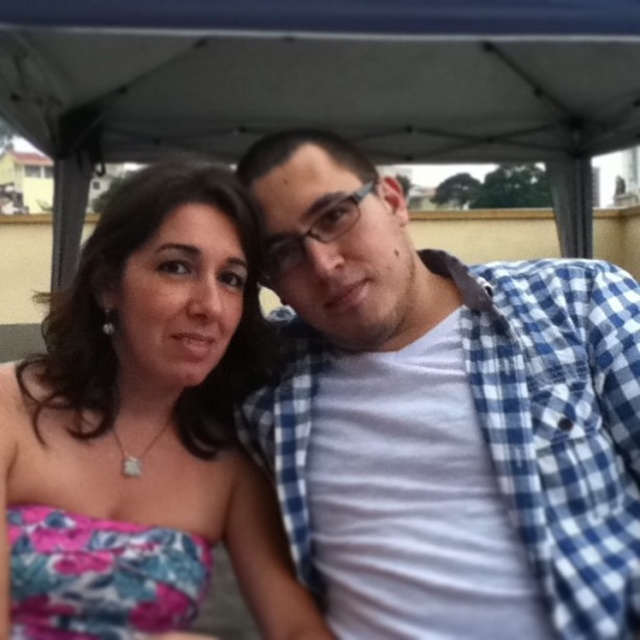
Who is positioned more to the right, blue checkered shirt at center or pink floral dress at center?

From the viewer's perspective, blue checkered shirt at center appears more on the right side.

Image resolution: width=640 pixels, height=640 pixels. In order to click on blue checkered shirt at center in this screenshot , I will do `click(442, 417)`.

Is point (614, 292) more distant than point (211, 253)?

Yes.

This screenshot has width=640, height=640. I want to click on blue checkered shirt at center, so click(x=442, y=417).